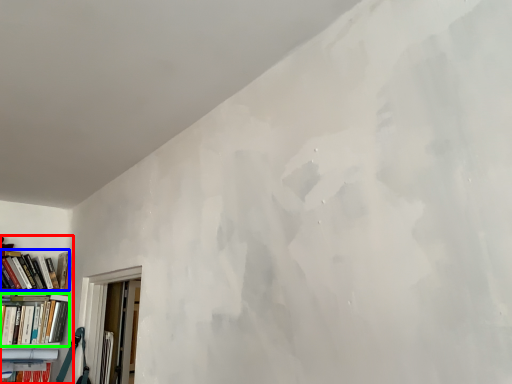
Question: Based on their relative distances, which object is nearer to bookcase (highlighted by a red box)? Choose from book (highlighted by a blue box) and book (highlighted by a green box).

Choices:
 (A) book
 (B) book

Answer: (B)